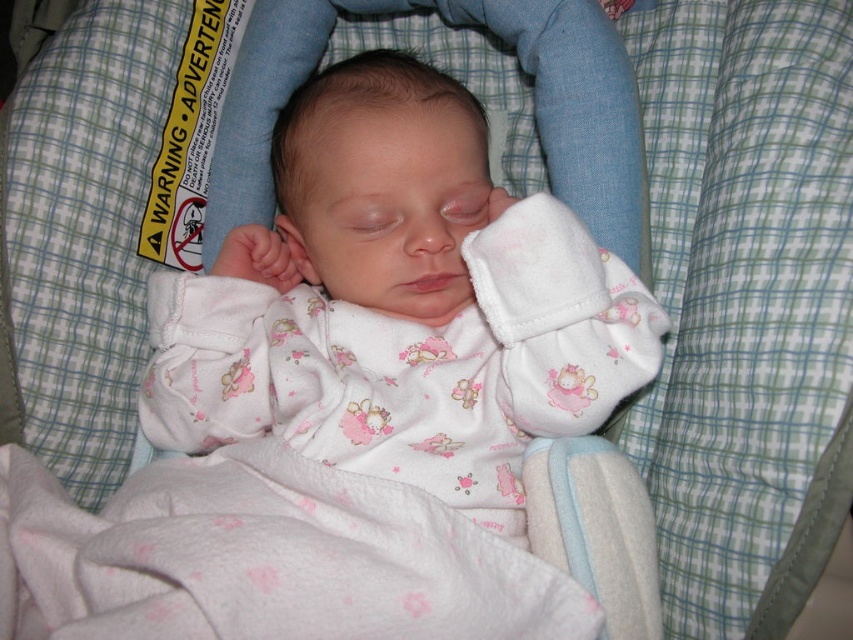
You are a caregiver checking the baby swing. The swing has a height limit of 60 cm for safety. The white fleece blanket at center is 40 cm tall. Can the white soft fabric baby at center fit safely in the swing?

The white soft fabric baby at center has a greater height compared to the white fleece blanket at center, which is 40 cm tall. Since the baby is taller than the blanket, the baby might exceed the 60 cm height limit. To ensure safety, measure the baby to confirm if they are within the limit.

You are a caregiver checking on a sleeping baby in the swing. You notice the white soft fabric baby at center and the white fleece blanket at center. Which object is positioned to the right side?

The white soft fabric baby at center is positioned to the right of the white fleece blanket at center.

You are a caregiver checking the baby in the swing. The baby is wearing a white onesie with pink and light blue patterns. You notice the white soft fabric baby at center and the white fleece blanket at center. Which one is positioned higher?

The white soft fabric baby at center is positioned higher than the white fleece blanket at center.